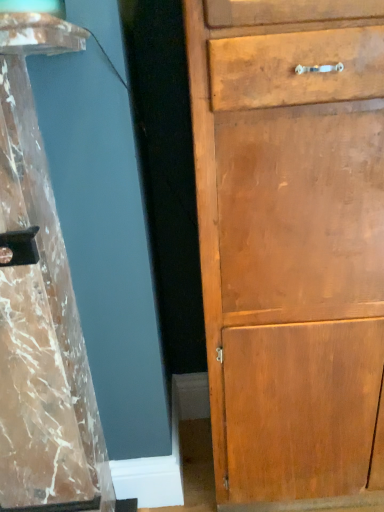
Question: Is marble-like wood at left positioned with its back to wooden cabinet at right?

Choices:
 (A) no
 (B) yes

Answer: (A)

Question: From a real-world perspective, is marble-like wood at left located higher than wooden cabinet at right?

Choices:
 (A) yes
 (B) no

Answer: (B)

Question: Can you confirm if marble-like wood at left is bigger than wooden cabinet at right?

Choices:
 (A) no
 (B) yes

Answer: (A)

Question: Considering the relative positions of marble-like wood at left and wooden cabinet at right in the image provided, is marble-like wood at left to the left of wooden cabinet at right from the viewer's perspective?

Choices:
 (A) no
 (B) yes

Answer: (B)

Question: Is marble-like wood at left taller than wooden cabinet at right?

Choices:
 (A) yes
 (B) no

Answer: (B)

Question: From the image's perspective, is marble-like wood at left on wooden cabinet at right?

Choices:
 (A) no
 (B) yes

Answer: (A)

Question: Considering the relative sizes of wooden cabinet at right and marble-like wood at left in the image provided, is wooden cabinet at right smaller than marble-like wood at left?

Choices:
 (A) yes
 (B) no

Answer: (B)

Question: Could you tell me if wooden cabinet at right is turned towards marble-like wood at left?

Choices:
 (A) no
 (B) yes

Answer: (A)

Question: Can you confirm if wooden cabinet at right is shorter than marble-like wood at left?

Choices:
 (A) yes
 (B) no

Answer: (B)

Question: From a real-world perspective, is wooden cabinet at right on top of marble-like wood at left?

Choices:
 (A) no
 (B) yes

Answer: (B)

Question: From the image's perspective, is wooden cabinet at right located above marble-like wood at left?

Choices:
 (A) no
 (B) yes

Answer: (B)

Question: Does wooden cabinet at right appear on the left side of marble-like wood at left?

Choices:
 (A) no
 (B) yes

Answer: (A)

Question: Looking at their shapes, would you say wooden cabinet at right is wider or thinner than marble-like wood at left?

Choices:
 (A) thin
 (B) wide

Answer: (A)